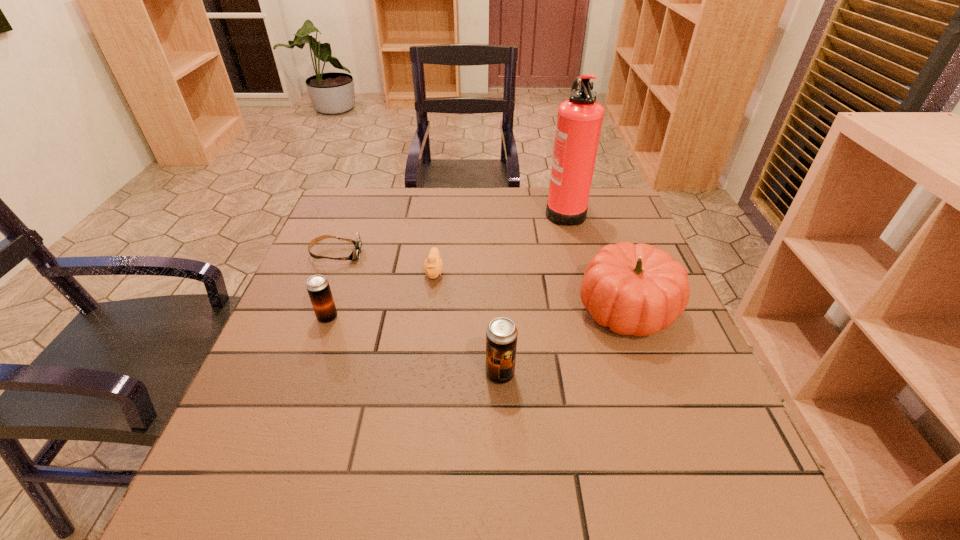
I want to click on vacant point located between the fire extinguisher and the fourth object from right to left, so click(499, 241).

Find the location of a particular element. vacant space in between the fire extinguisher and the third object from right to left is located at coordinates (532, 292).

You are a GUI agent. You are given a task and a screenshot of the screen. Output one action in this format:
    pyautogui.click(x=<x>, y=<y>)
    Task: Click on the vacant space that is in between the shortest object and the pumpkin
    The height and width of the screenshot is (540, 960).
    Given the screenshot: What is the action you would take?
    [482, 282]

Image resolution: width=960 pixels, height=540 pixels. Find the location of `blank region between the nearer beer can and the duckling`. blank region between the nearer beer can and the duckling is located at coordinates (468, 323).

Find the location of a particular element. This screenshot has height=540, width=960. vacant area that lies between the fourth object from right to left and the farthest object is located at coordinates (499, 241).

This screenshot has height=540, width=960. In order to click on vacant space that's between the pumpkin and the right beer can in this screenshot , I will do `click(564, 342)`.

At what (x,y) coordinates should I click in order to perform the action: click on object that is the third nearest to the pumpkin. Please return your answer as a coordinate pair (x, y). This screenshot has width=960, height=540. Looking at the image, I should click on (433, 265).

Select which object appears as the fifth closest to the third shortest object. Please provide its 2D coordinates. Your answer should be formatted as a tuple, i.e. [(x, y)], where the tuple contains the x and y coordinates of a point satisfying the conditions above.

[(579, 121)]

Locate an element on the screen. vacant region that satisfies the following two spatial constraints: 1. on the face of the duckling; 2. on the right side of the third object from right to left is located at coordinates (421, 374).

Locate an element on the screen. This screenshot has width=960, height=540. vacant space that satisfies the following two spatial constraints: 1. on the face of the pumpkin; 2. on the left side of the fifth tallest object is located at coordinates pos(429,310).